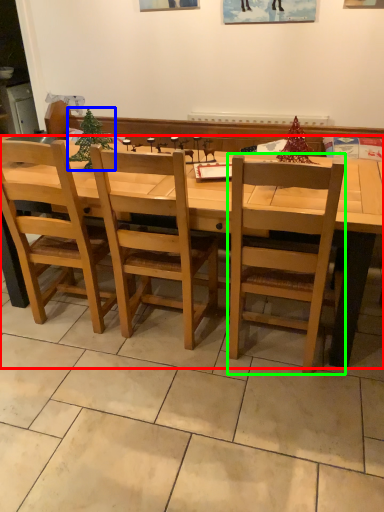
Question: Which is nearer to the desk (highlighted by a red box)? christmas tree (highlighted by a blue box) or chair (highlighted by a green box).

Choices:
 (A) christmas tree
 (B) chair

Answer: (B)